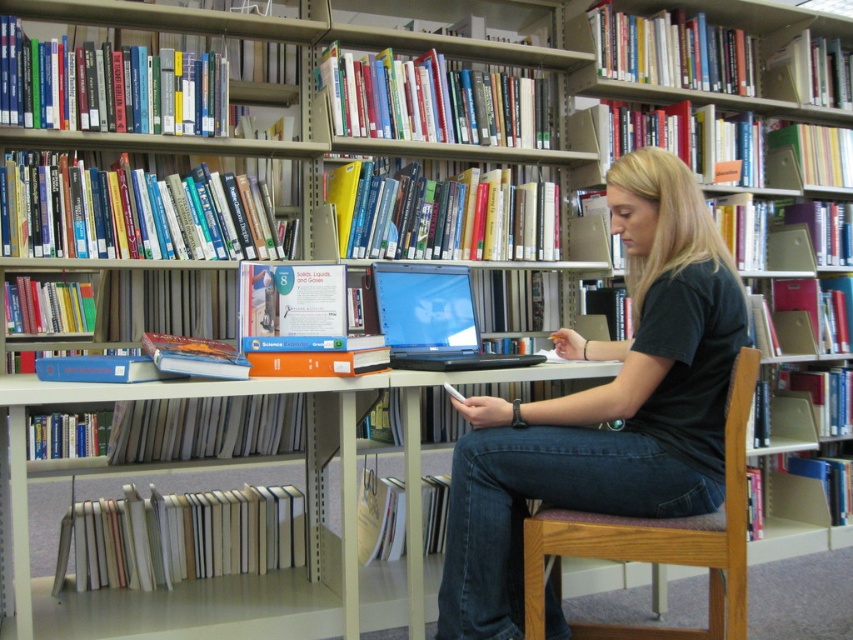
Question: Which of the following is the farthest from the observer?

Choices:
 (A) (730, 632)
 (B) (372, 262)
 (C) (635, 374)

Answer: (B)

Question: Does black cotton shirt at center have a greater width compared to white plastic table at center?

Choices:
 (A) no
 (B) yes

Answer: (A)

Question: Which object appears closest to the camera in this image?

Choices:
 (A) wooden chair at center
 (B) shiny black laptop at center

Answer: (A)

Question: Is white plastic table at center positioned behind wooden chair at center?

Choices:
 (A) no
 (B) yes

Answer: (B)

Question: Which point appears farthest from the camera in this image?

Choices:
 (A) (486, 358)
 (B) (167, 620)
 (C) (660, 634)

Answer: (B)

Question: Can you confirm if white plastic table at center is wider than wooden chair at center?

Choices:
 (A) yes
 (B) no

Answer: (A)